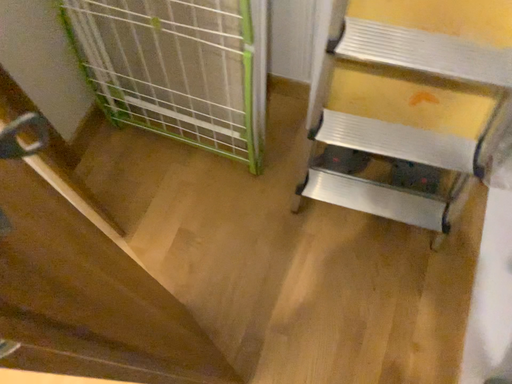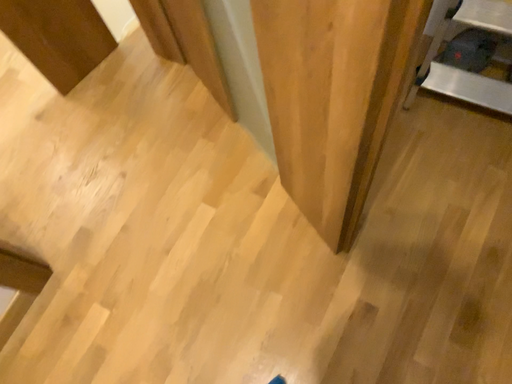
Question: How did the camera likely rotate when shooting the video?

Choices:
 (A) rotated left
 (B) rotated right

Answer: (A)